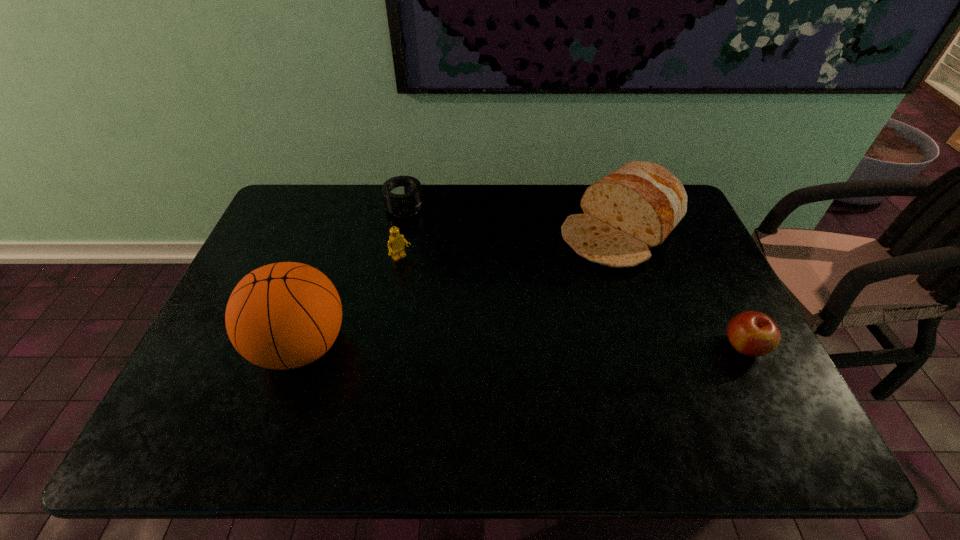
Where is `the tallest object`? the tallest object is located at coordinates pos(285,315).

Identify the location of basketball. (285, 315).

Find the location of `apple`. apple is located at coordinates (752, 333).

Where is `telephoto lens`? This screenshot has height=540, width=960. telephoto lens is located at coordinates (402, 195).

In order to click on the second tallest object in this screenshot , I will do `click(634, 208)`.

At what (x,y) coordinates should I click in order to perform the action: click on Lego. Please return your answer as a coordinate pair (x, y). This screenshot has width=960, height=540. Looking at the image, I should click on (396, 246).

Where is `free location located 0.330m on the right of the tallest object`? The width and height of the screenshot is (960, 540). free location located 0.330m on the right of the tallest object is located at coordinates (482, 346).

Identify the location of vacant region located 0.270m on the side of the shortest object with brand markings and control switches. (436, 273).

This screenshot has width=960, height=540. In order to click on vacant space located on the side of the shortest object with brand markings and control switches in this screenshot , I will do `click(420, 240)`.

Locate an element on the screen. The width and height of the screenshot is (960, 540). free space located on the side of the shortest object with brand markings and control switches is located at coordinates (425, 252).